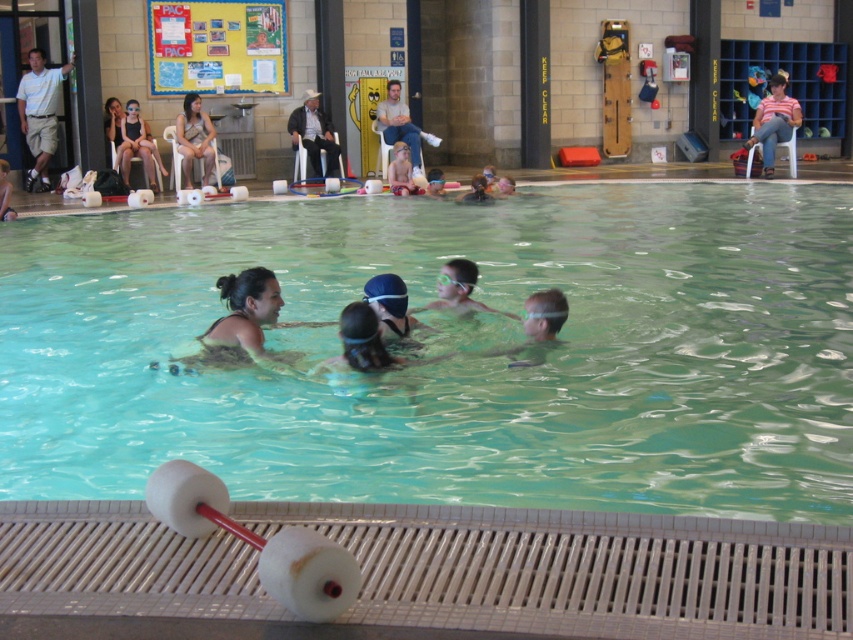
You are a photographer taking a picture of the smooth skin woman at center and the matte black swim cap at upper center. Which object will appear larger in the photo?

The smooth skin woman at center will appear larger in the photo because she is much taller than the matte black swim cap at upper center.

In the swimming pool scene, there is a smooth skin woman at center and a striped shirt at upper right. Which object is shorter in height?

The smooth skin woman at center is shorter in height compared to the striped shirt at upper right.